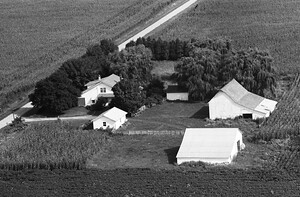
Identify the location of door. The image size is (300, 197). (176, 98).